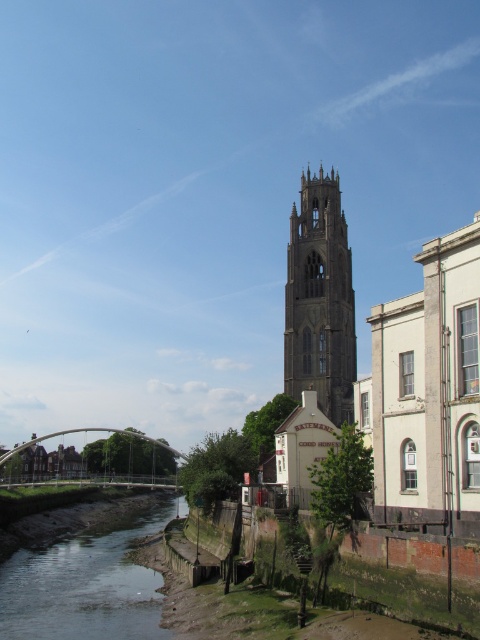
Looking at this image, you are standing at the center of the image and want to find the clear water at lower left. According to the scene description, which direction should you look to locate it?

The clear water at lower left is located at point (86,586), so you should look to the lower left direction from the center to find it.

You are an architect analyzing the riverside scene. You need to determine the relative heights of the clear water at lower left and the stone gothic tower at center. Which one has a greater height in the image?

The stone gothic tower at center is taller than the clear water at lower left, so the stone gothic tower at center has a greater height.

You are a tourist standing on the white metallic bridge at lower center and want to take a photo of the stone gothic tower at center. Can you see the tower clearly from your current position?

The white metallic bridge at lower center is behind the stone gothic tower at center, so the tower would block your view. You cannot see the tower clearly from your current position on the bridge.